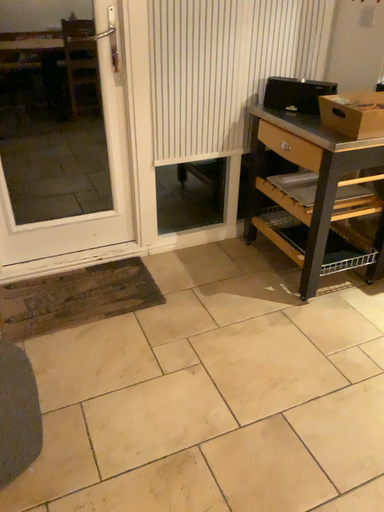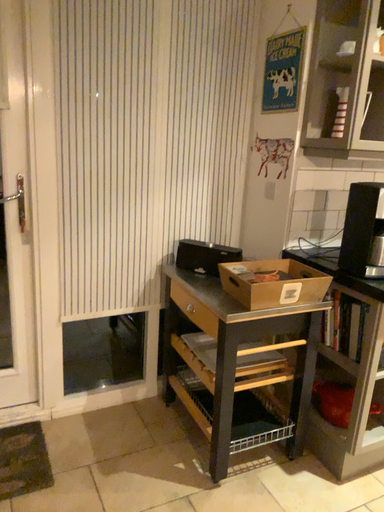
Question: Which way did the camera rotate in the video?

Choices:
 (A) rotated upward
 (B) rotated downward

Answer: (A)